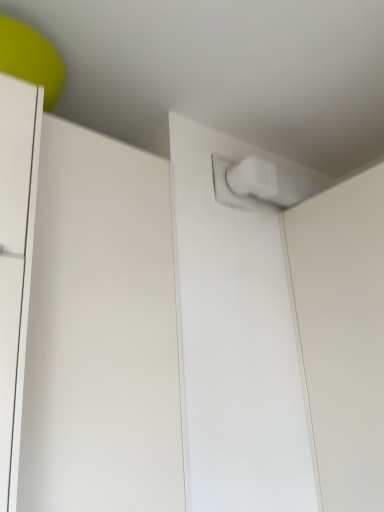
Describe the element at coordinates (100, 332) in the screenshot. I see `white matte door at center` at that location.

Where is `white matte door at center`? The image size is (384, 512). white matte door at center is located at coordinates (100, 332).

In order to face white matte door at center, should I rotate leftwards or rightwards?

A 10.663 degree turn to the left will do.

What are the coordinates of `white matte door at center` in the screenshot? It's located at (100, 332).